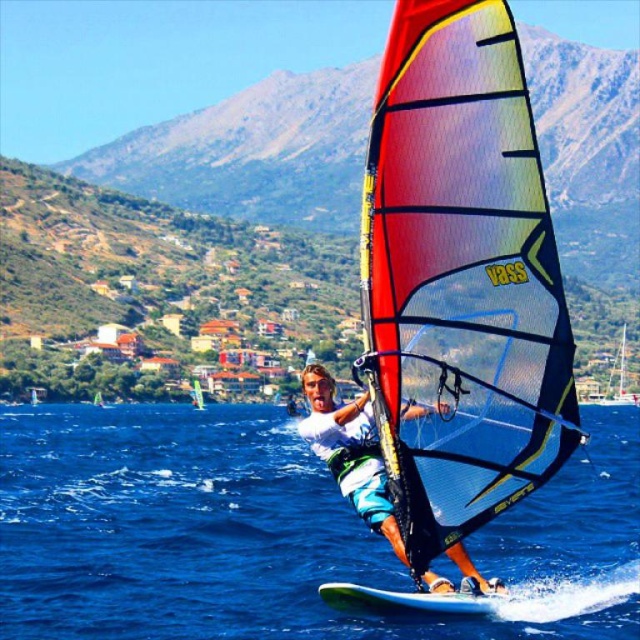
Question: Estimate the real-world distances between objects in this image. Which object is farther from the blue water at center?

Choices:
 (A) green mesh sail at center
 (B) translucent yellow sail at center

Answer: (A)

Question: Which object is closer to the camera taking this photo?

Choices:
 (A) translucent yellow sail at center
 (B) matte white windsurfing board at center
 (C) green mesh sail at center
 (D) blue water at center

Answer: (B)

Question: From the image, what is the correct spatial relationship of blue water at center in relation to green mesh sail at center?

Choices:
 (A) right
 (B) left

Answer: (A)

Question: Is multicolored mesh sail at center thinner than translucent yellow sail at center?

Choices:
 (A) yes
 (B) no

Answer: (B)

Question: Among these objects, which one is nearest to the camera?

Choices:
 (A) multicolored mesh sail at center
 (B) green mesh sail at center
 (C) translucent yellow sail at center
 (D) blue water at center

Answer: (A)

Question: Considering the relative positions of matte white windsurfing board at center and translucent yellow sail at center in the image provided, where is matte white windsurfing board at center located with respect to translucent yellow sail at center?

Choices:
 (A) above
 (B) below

Answer: (A)